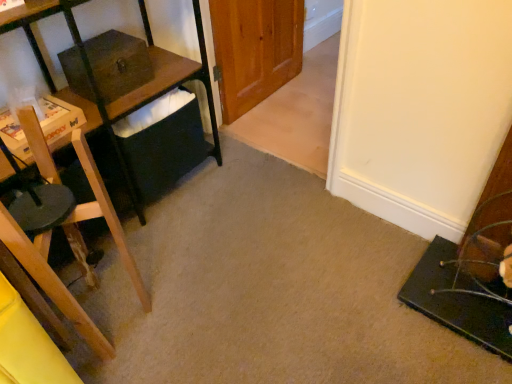
What do you see at coordinates (51, 281) in the screenshot? The width and height of the screenshot is (512, 384). I see `wooden chair at left` at bounding box center [51, 281].

Where is `wooden chair at left`? This screenshot has width=512, height=384. wooden chair at left is located at coordinates (51, 281).

Locate an element on the screen. This screenshot has width=512, height=384. wooden chair at left is located at coordinates (51, 281).